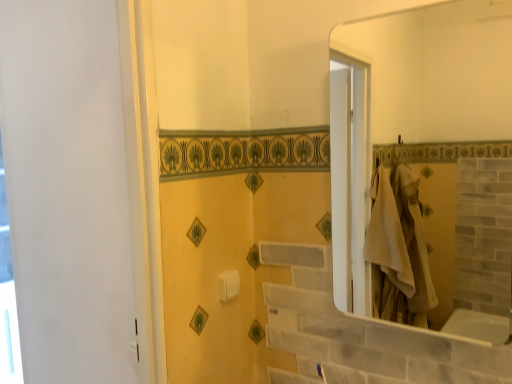
Image resolution: width=512 pixels, height=384 pixels. What do you see at coordinates (437, 71) in the screenshot? I see `white glossy mirror at upper right` at bounding box center [437, 71].

The image size is (512, 384). What do you see at coordinates (7, 297) in the screenshot?
I see `white glossy window at left` at bounding box center [7, 297].

Where is `white plastic towel bar at center`? The height and width of the screenshot is (384, 512). white plastic towel bar at center is located at coordinates (228, 285).

From the image's perspective, which one is positioned lower, white plastic towel bar at center or white glossy window at left?

white glossy window at left is shown below in the image.

Considering the relative sizes of white plastic towel bar at center and white glossy window at left in the image provided, is white plastic towel bar at center thinner than white glossy window at left?

Yes, white plastic towel bar at center is thinner than white glossy window at left.

Is white plastic towel bar at center situated inside white glossy window at left or outside?

white plastic towel bar at center is located beyond the bounds of white glossy window at left.

Between white plastic towel bar at center and white glossy window at left, which one appears on the left side from the viewer's perspective?

From the viewer's perspective, white glossy window at left appears more on the left side.

Which is correct: white glossy mirror at upper right is inside white glossy window at left, or outside of it?

The correct answer is: outside.

Is white glossy mirror at upper right oriented towards white glossy window at left?

No, white glossy mirror at upper right does not turn towards white glossy window at left.

Does white glossy mirror at upper right have a larger size compared to white glossy window at left?

Correct, white glossy mirror at upper right is larger in size than white glossy window at left.

Is white glossy mirror at upper right far away from white glossy window at left?

Absolutely, white glossy mirror at upper right is distant from white glossy window at left.

Consider the image. From the image's perspective, which is above, white glossy window at left or white glossy mirror at upper right?

white glossy mirror at upper right.

From a real-world perspective, is white glossy window at left located beneath white glossy mirror at upper right?

Yes, from a real-world perspective, white glossy window at left is beneath white glossy mirror at upper right.

Would you say white glossy window at left is inside or outside white glossy mirror at upper right?

white glossy window at left is not inside white glossy mirror at upper right, it's outside.

Which is closer, [19,348] or [503,10]?

Positioned in front is point [503,10].

Is point (225, 289) closer or farther from the camera than point (385, 22)?

Point (225, 289) is closer to the camera than point (385, 22).

Where is `towel bar on the left of white glossy mirror at upper right`? The image size is (512, 384). towel bar on the left of white glossy mirror at upper right is located at coordinates (228, 285).

Are white plastic towel bar at center and white glossy mirror at upper right far apart?

Yes.

Choose the correct answer: Is white plastic towel bar at center inside white glossy mirror at upper right or outside it?

white plastic towel bar at center is outside white glossy mirror at upper right.

Which of these two, white glossy window at left or white plastic towel bar at center, is wider?

white glossy window at left is wider.

Where is `window below the white plastic towel bar at center (from a real-world perspective)`? window below the white plastic towel bar at center (from a real-world perspective) is located at coordinates (7, 297).

Is white glossy window at left outside of white plastic towel bar at center?

Yes, white glossy window at left is located beyond the bounds of white plastic towel bar at center.

From the image's perspective, who appears lower, white glossy window at left or white plastic towel bar at center?

From the image's view, white glossy window at left is below.

From the image's perspective, which one is positioned higher, white glossy mirror at upper right or white plastic towel bar at center?

white glossy mirror at upper right.

Does white glossy mirror at upper right have a greater height compared to white plastic towel bar at center?

Yes.

Is white glossy mirror at upper right inside the boundaries of white plastic towel bar at center, or outside?

white glossy mirror at upper right is spatially situated outside white plastic towel bar at center.

Considering the sizes of objects white glossy mirror at upper right and white plastic towel bar at center in the image provided, who is smaller, white glossy mirror at upper right or white plastic towel bar at center?

With smaller size is white plastic towel bar at center.

What are the coordinates of `window that is below the white plastic towel bar at center (from the image's perspective)` in the screenshot? It's located at (7, 297).

The width and height of the screenshot is (512, 384). In order to click on mirror that is in front of the white glossy window at left in this screenshot , I will do `click(437, 71)`.

Based on their spatial positions, is white glossy mirror at upper right or white plastic towel bar at center further from white glossy window at left?

Among the two, white glossy mirror at upper right is located further to white glossy window at left.

When comparing their distances from white plastic towel bar at center, does white glossy window at left or white glossy mirror at upper right seem closer?

white glossy mirror at upper right lies closer to white plastic towel bar at center than the other object.

From the image, which object appears to be nearer to white plastic towel bar at center, white glossy mirror at upper right or white glossy window at left?

Based on the image, white glossy mirror at upper right appears to be nearer to white plastic towel bar at center.

From the image, which object appears to be nearer to white glossy mirror at upper right, white plastic towel bar at center or white glossy window at left?

white plastic towel bar at center.

Which object lies nearer to the anchor point white glossy mirror at upper right, white glossy window at left or white plastic towel bar at center?

white plastic towel bar at center.

Considering their positions, is white plastic towel bar at center positioned further to white glossy window at left than white glossy mirror at upper right?

white glossy mirror at upper right.

This screenshot has width=512, height=384. What are the coordinates of `towel bar between white glossy window at left and white glossy mirror at upper right` in the screenshot? It's located at (228, 285).